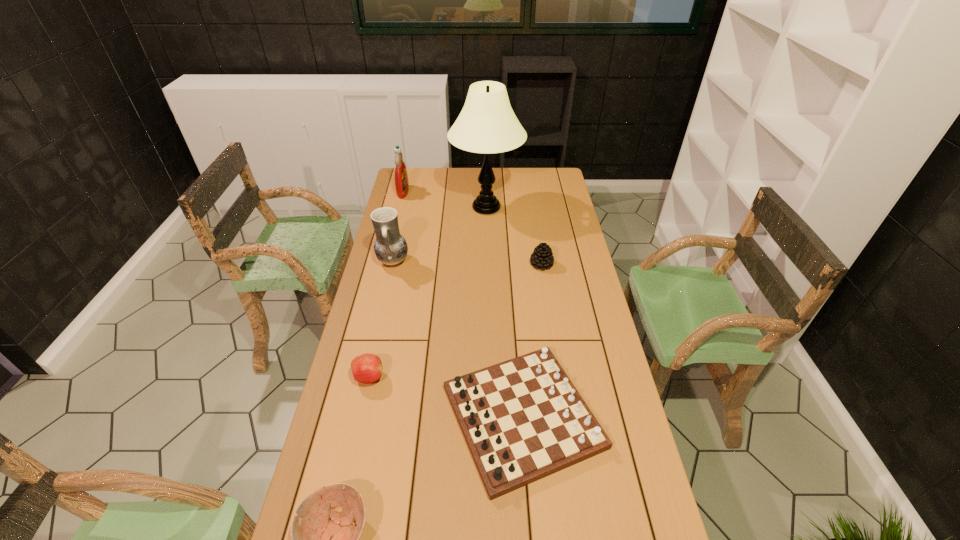
Where is `vacant region at the left edge of the desktop`? vacant region at the left edge of the desktop is located at coordinates (358, 334).

At what (x,y) coordinates should I click in order to perform the action: click on free space at the right edge. Please return your answer as a coordinate pair (x, y). The width and height of the screenshot is (960, 540). Looking at the image, I should click on (559, 195).

You are a GUI agent. You are given a task and a screenshot of the screen. Output one action in this format:
    pyautogui.click(x=<x>, y=<y>)
    Task: Click on the vacant space at the far left corner of the desktop
    Image resolution: width=960 pixels, height=540 pixels.
    Given the screenshot: What is the action you would take?
    pyautogui.click(x=425, y=186)

Find the location of a particular element. This screenshot has width=960, height=540. vacant space at the far right corner is located at coordinates [556, 172].

Where is `free space that is in between the detergent and the pinecone`? This screenshot has height=540, width=960. free space that is in between the detergent and the pinecone is located at coordinates (472, 228).

I want to click on free space between the tallest object and the apple, so click(x=427, y=293).

Identify the location of free spot between the pinecone and the chessboard. (532, 340).

I want to click on vacant space that's between the detergent and the chessboard, so tap(463, 304).

Locate an element on the screen. Image resolution: width=960 pixels, height=540 pixels. free area in between the lamp and the apple is located at coordinates (427, 293).

Locate which object is the third closest to the apple. Please provide its 2D coordinates. Your answer should be formatted as a tuple, i.e. [(x, y)], where the tuple contains the x and y coordinates of a point satisfying the conditions above.

[(390, 247)]